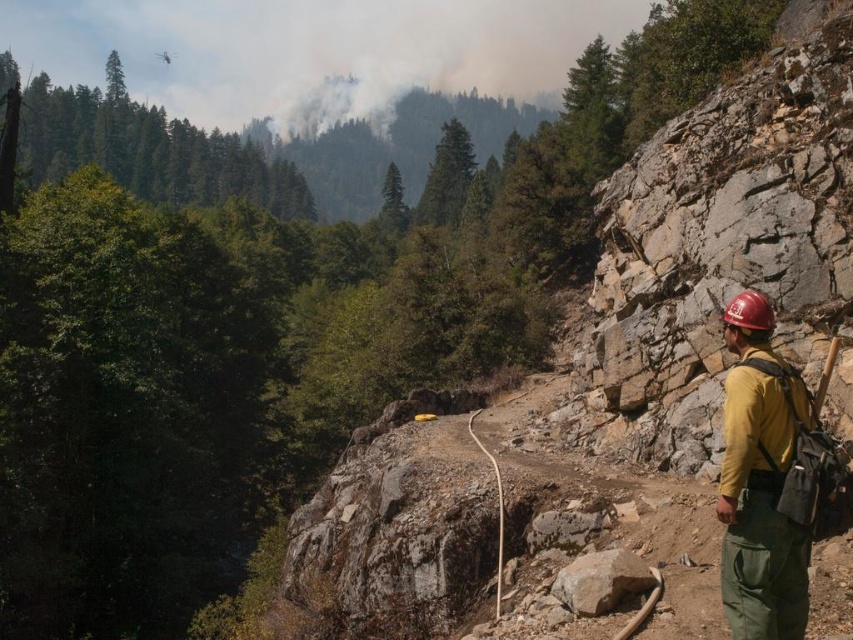
Question: Which object appears closest to the camera in this image?

Choices:
 (A) yellow fabric backpack at right
 (B) gray rough rock at center

Answer: (A)

Question: In this image, where is yellow fabric backpack at right located relative to gray rough rock at center?

Choices:
 (A) below
 (B) above

Answer: (B)

Question: Does yellow fabric backpack at right lie behind gray rough rock at center?

Choices:
 (A) yes
 (B) no

Answer: (B)

Question: Does yellow fabric backpack at right have a lesser width compared to gray rough rock at center?

Choices:
 (A) no
 (B) yes

Answer: (B)